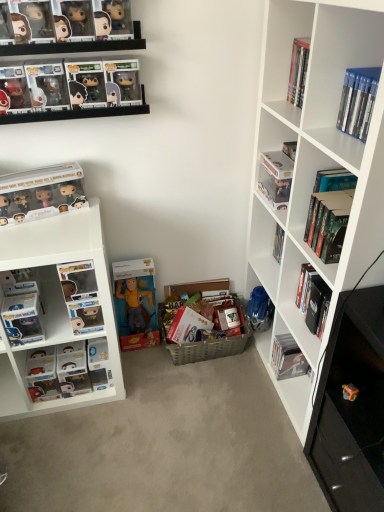
The image size is (384, 512). I want to click on free space between white plastic shelves at left and hardcover book at lower right, the fourth book positioned from the right, so 178,382.